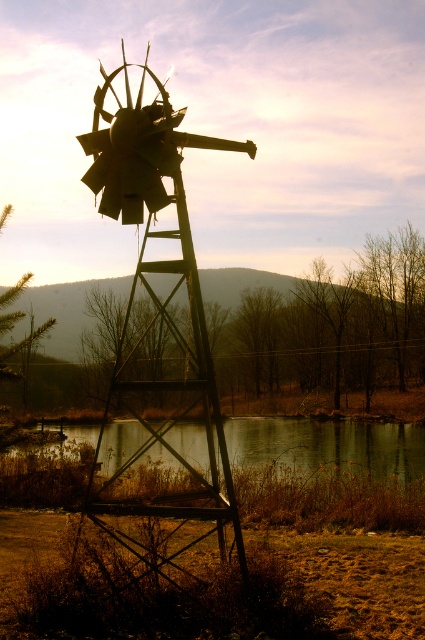
Question: Does rusty metal windmill at center appear under smooth reflective water at lower center?

Choices:
 (A) yes
 (B) no

Answer: (B)

Question: Which point is closer to the camera?

Choices:
 (A) smooth reflective water at lower center
 (B) rusty metal windmill at center

Answer: (B)

Question: Which of the following is the closest to the observer?

Choices:
 (A) rusty metal windmill at center
 (B) smooth reflective water at lower center

Answer: (A)

Question: Is rusty metal windmill at center behind smooth reflective water at lower center?

Choices:
 (A) no
 (B) yes

Answer: (A)

Question: Is rusty metal windmill at center above smooth reflective water at lower center?

Choices:
 (A) no
 (B) yes

Answer: (B)